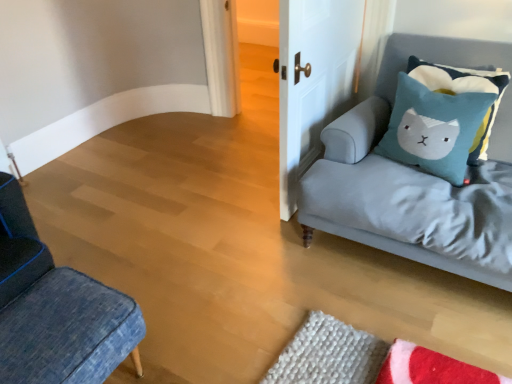
Question: Does white matte door at upper center have a greater width compared to blue felt pillow at upper right, which is counted as the first pillow, starting from the left?

Choices:
 (A) yes
 (B) no

Answer: (B)

Question: Does white matte door at upper center have a greater height compared to blue felt pillow at upper right, acting as the second pillow starting from the right?

Choices:
 (A) yes
 (B) no

Answer: (A)

Question: From a real-world perspective, is white matte door at upper center on top of blue felt pillow at upper right, acting as the second pillow starting from the right?

Choices:
 (A) no
 (B) yes

Answer: (A)

Question: Is white matte door at upper center oriented towards blue felt pillow at upper right, acting as the second pillow starting from the right?

Choices:
 (A) yes
 (B) no

Answer: (A)

Question: From the image's perspective, is white matte door at upper center beneath blue felt pillow at upper right, acting as the second pillow starting from the right?

Choices:
 (A) yes
 (B) no

Answer: (B)

Question: From their relative heights in the image, would you say light gray fabric couch at right is taller or shorter than denim cushion at lower left?

Choices:
 (A) tall
 (B) short

Answer: (A)

Question: From the image's perspective, is light gray fabric couch at right positioned above or below denim cushion at lower left?

Choices:
 (A) below
 (B) above

Answer: (B)

Question: Considering the positions of light gray fabric couch at right and denim cushion at lower left in the image, is light gray fabric couch at right bigger or smaller than denim cushion at lower left?

Choices:
 (A) small
 (B) big

Answer: (B)

Question: Is light gray fabric couch at right wider or thinner than denim cushion at lower left?

Choices:
 (A) thin
 (B) wide

Answer: (B)

Question: Based on their sizes in the image, would you say teal felt pillow at upper right, which is counted as the 2th pillow, starting from the left, is bigger or smaller than blue felt pillow at upper right, acting as the second pillow starting from the right?

Choices:
 (A) small
 (B) big

Answer: (A)

Question: In terms of height, does teal felt pillow at upper right, which is counted as the first pillow, starting from the right, look taller or shorter compared to blue felt pillow at upper right, acting as the second pillow starting from the right?

Choices:
 (A) tall
 (B) short

Answer: (B)

Question: Considering the relative positions of teal felt pillow at upper right, which is counted as the 2th pillow, starting from the left, and blue felt pillow at upper right, which is counted as the first pillow, starting from the left, in the image provided, is teal felt pillow at upper right, which is counted as the 2th pillow, starting from the left, to the left or to the right of blue felt pillow at upper right, which is counted as the first pillow, starting from the left,?

Choices:
 (A) right
 (B) left

Answer: (A)

Question: From the image's perspective, relative to blue felt pillow at upper right, acting as the second pillow starting from the right, is teal felt pillow at upper right, which is counted as the 2th pillow, starting from the left, above or below?

Choices:
 (A) above
 (B) below

Answer: (A)

Question: From a real-world perspective, is denim cushion at lower left positioned above or below blue felt pillow at upper right, which is counted as the first pillow, starting from the left?

Choices:
 (A) below
 (B) above

Answer: (A)

Question: Would you say denim cushion at lower left is to the left or to the right of blue felt pillow at upper right, which is counted as the first pillow, starting from the left, in the picture?

Choices:
 (A) right
 (B) left

Answer: (B)